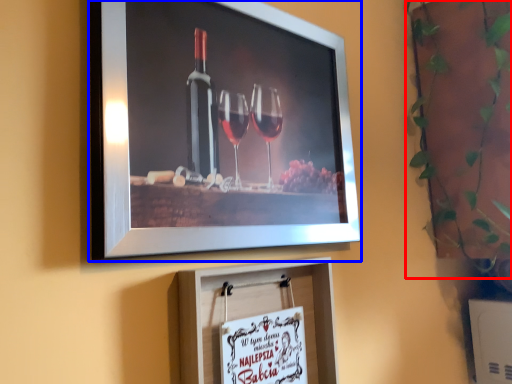
Question: Which object appears farthest to the camera in this image, plant (highlighted by a red box) or picture frame (highlighted by a blue box)?

Choices:
 (A) plant
 (B) picture frame

Answer: (A)